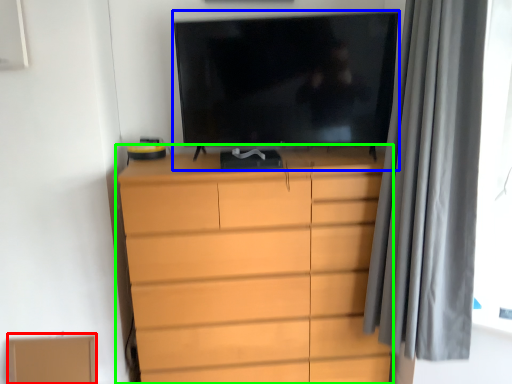
Question: Which is nearer to the cardboard box (highlighted by a red box)? television (highlighted by a blue box) or chest of drawers (highlighted by a green box).

Choices:
 (A) television
 (B) chest of drawers

Answer: (B)